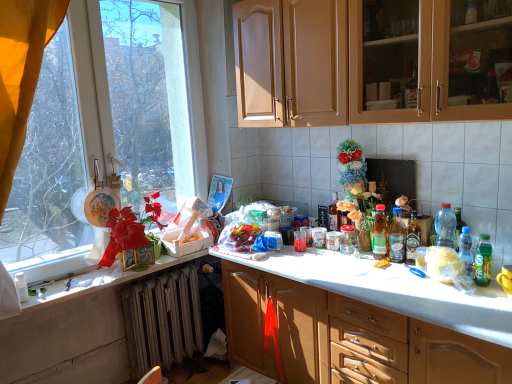
This screenshot has height=384, width=512. What are the coordinates of `vacant area on top of matte white counter top at left (from a real-world perspective)` in the screenshot? It's located at (101, 276).